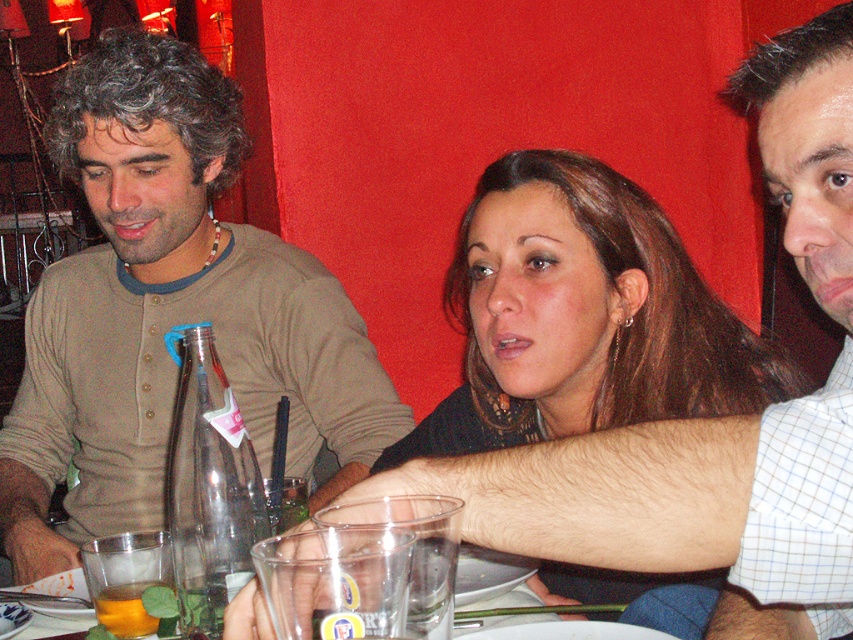
Question: Which of the following is the farthest from the observer?

Choices:
 (A) translucent glass cup at lower left
 (B) smooth brown hair at center
 (C) translucent glass at lower left
 (D) matte brown shirt at left

Answer: (D)

Question: Does smooth brown hair at center appear on the right side of translucent glass at lower left?

Choices:
 (A) no
 (B) yes

Answer: (B)

Question: Which point is farther to the camera?

Choices:
 (A) translucent glass at lower left
 (B) matte brown shirt at left

Answer: (B)

Question: Among these objects, which one is nearest to the camera?

Choices:
 (A) translucent glass at lower left
 (B) smooth brown hair at center
 (C) translucent glass cup at lower left

Answer: (A)

Question: Is translucent glass at lower left positioned behind translucent glass cup at lower left?

Choices:
 (A) no
 (B) yes

Answer: (A)

Question: Does matte brown shirt at left appear on the right side of translucent glass at lower left?

Choices:
 (A) no
 (B) yes

Answer: (A)